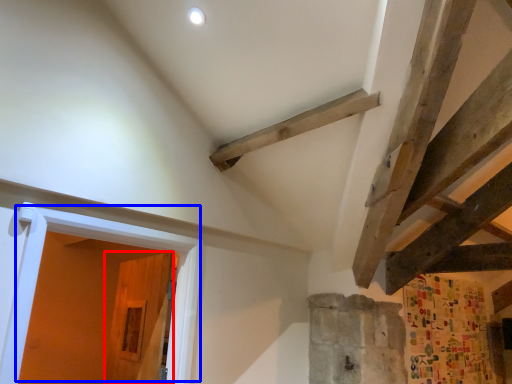
Question: Among these objects, which one is farthest to the camera, door (highlighted by a red box) or door (highlighted by a blue box)?

Choices:
 (A) door
 (B) door

Answer: (A)